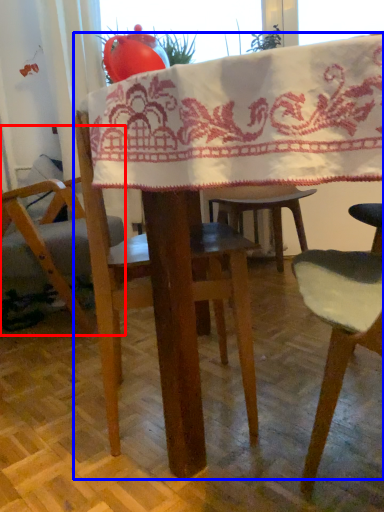
Question: Which of the following is the closest to the observer, chair (highlighted by a red box) or table (highlighted by a blue box)?

Choices:
 (A) chair
 (B) table

Answer: (B)